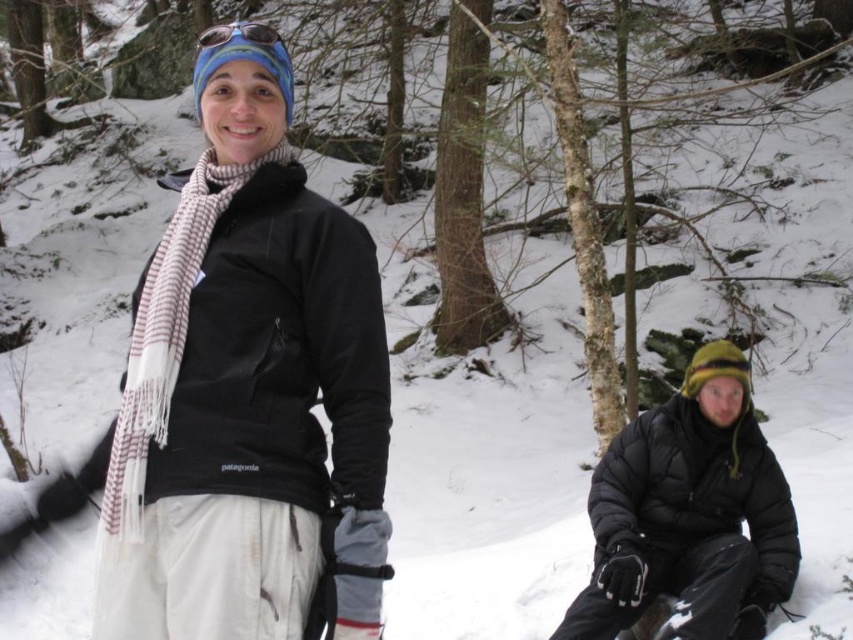
Does black puffy jacket at lower right appear on the right side of white striped scarf at center?

Correct, you'll find black puffy jacket at lower right to the right of white striped scarf at center.

How far apart are black puffy jacket at lower right and white striped scarf at center?

9.49 feet

Who is more forward, (x=741, y=611) or (x=151, y=429)?

Point (x=151, y=429) is in front.

Identify the location of black puffy jacket at lower right. (689, 515).

Does black puffy jacket at lower right appear under matte black goggles at upper center?

A: Yes.

Is black puffy jacket at lower right shorter than matte black goggles at upper center?

No.

At what (x,y) coordinates should I click in order to perform the action: click on black puffy jacket at lower right. Please return your answer as a coordinate pair (x, y). This screenshot has width=853, height=640. Looking at the image, I should click on (689, 515).

Can you confirm if black fleece jacket at center is positioned to the left of white striped scarf at center?

In fact, black fleece jacket at center is to the right of white striped scarf at center.

Does black fleece jacket at center appear over white striped scarf at center?

Actually, black fleece jacket at center is below white striped scarf at center.

Describe the element at coordinates (244, 385) in the screenshot. I see `black fleece jacket at center` at that location.

At what (x,y) coordinates should I click in order to perform the action: click on black fleece jacket at center. Please return your answer as a coordinate pair (x, y). The image size is (853, 640). Looking at the image, I should click on (x=244, y=385).